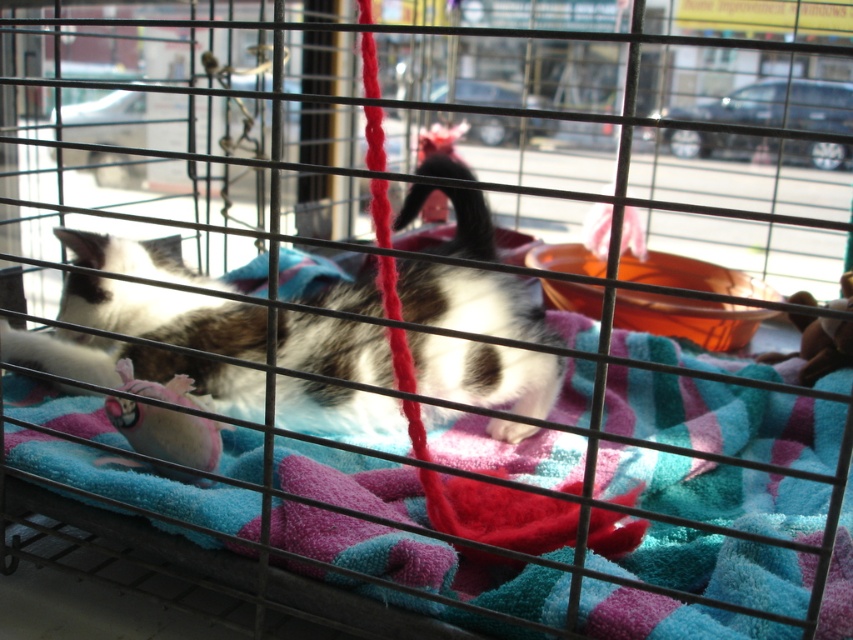
You are a visitor looking at the kittens through the metal cage. You notice a fluffy white cat at center and a pink fabric toy at lower left. Which object is positioned to the left of the other?

The pink fabric toy at lower left is positioned to the left of the fluffy white cat at center.

You are a cat owner who wants to play with your fluffy white cat at center and the rubber duck at center. Which object is bigger and better to use as a toy?

The fluffy white cat at center is larger than the rubber duck at center, so the rubber duck at center is better to use as a toy since it is smaller and easier for the cat to play with.

Looking at this image, you are a cat owner who wants to place a small toy for your kittens. You have a pink fabric toy at lower left and a rubber duck at center. Which toy is shorter?

The pink fabric toy at lower left has a lesser height compared to the rubber duck at center, so the pink fabric toy at lower left is shorter.